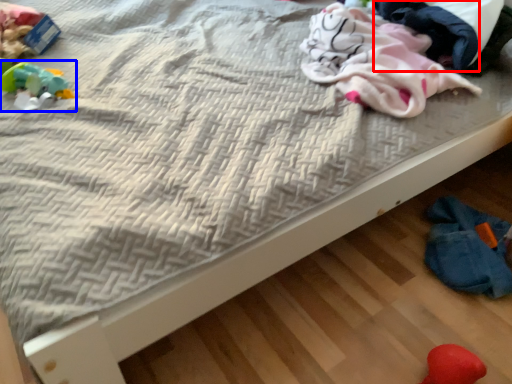
Question: Which object is further to the camera taking this photo, clothing (highlighted by a red box) or toy (highlighted by a blue box)?

Choices:
 (A) clothing
 (B) toy

Answer: (B)